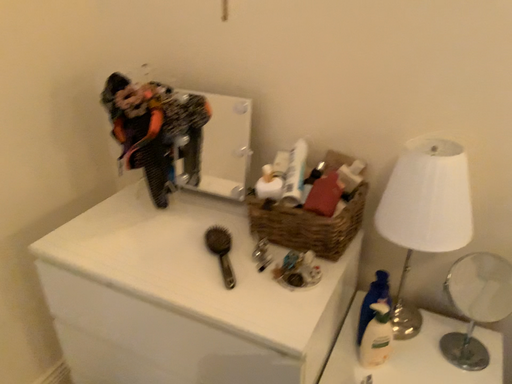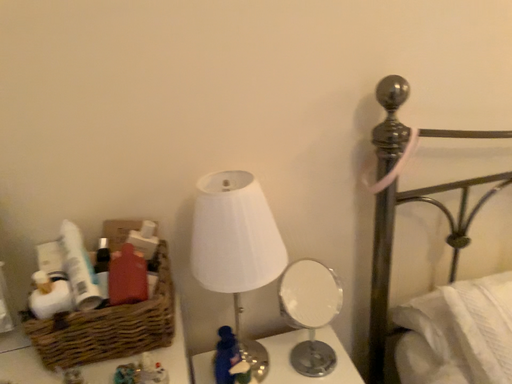
Question: Which way did the camera rotate in the video?

Choices:
 (A) rotated upward
 (B) rotated downward

Answer: (A)